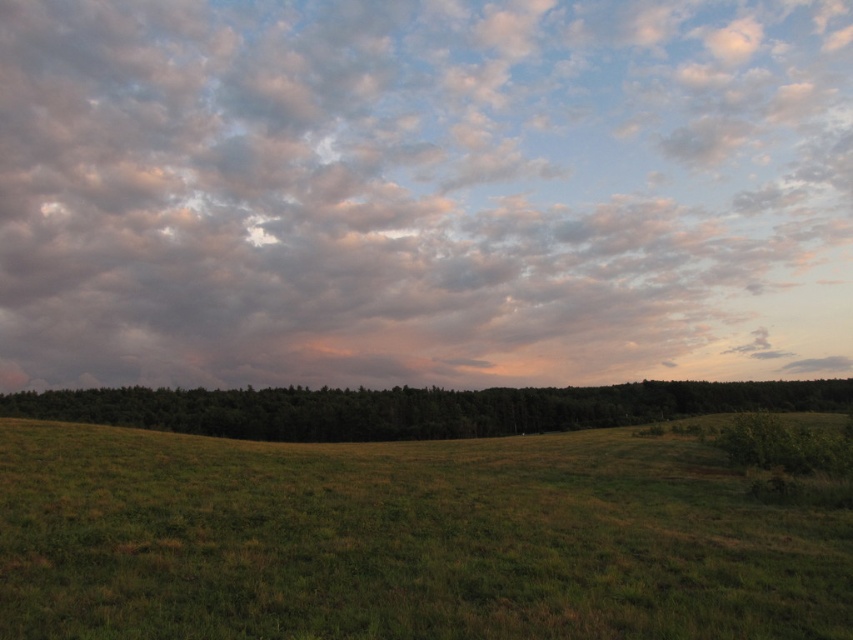
Between point (662, 296) and point (612, 397), which one is positioned in front?

Point (612, 397) is in front.

Who is higher up, cloudy sky at upper center or green leafy forest at center?

cloudy sky at upper center is higher up.

Is point (173, 276) positioned after point (354, 392)?

That is True.

The height and width of the screenshot is (640, 853). Find the location of `cloudy sky at upper center`. cloudy sky at upper center is located at coordinates (422, 192).

Who is more forward, (392, 548) or (219, 435)?

Point (392, 548)

Which is below, green grassy field at lower center or green leafy forest at center?

green leafy forest at center is lower down.

What do you see at coordinates (403, 540) in the screenshot?
I see `green grassy field at lower center` at bounding box center [403, 540].

Where is `green grassy field at lower center`? green grassy field at lower center is located at coordinates coord(403,540).

How far apart are cloudy sky at upper center and green grassy field at lower center?

cloudy sky at upper center and green grassy field at lower center are 280.34 meters apart from each other.

Is cloudy sky at upper center to the right of green grassy field at lower center from the viewer's perspective?

Correct, you'll find cloudy sky at upper center to the right of green grassy field at lower center.

Where is `cloudy sky at upper center`? cloudy sky at upper center is located at coordinates (422, 192).

Locate an element on the screen. This screenshot has height=640, width=853. cloudy sky at upper center is located at coordinates (422, 192).